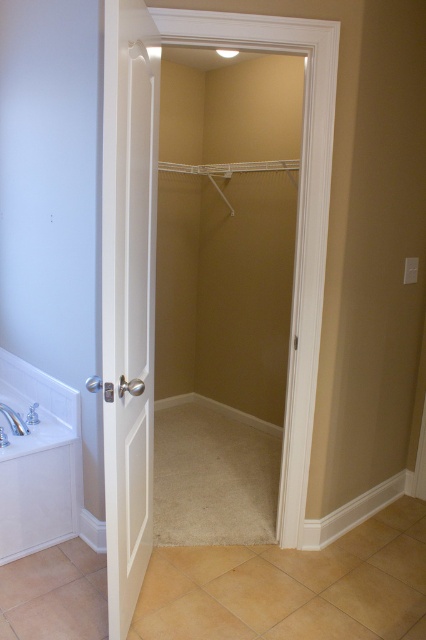
Question: Observing the image, what is the correct spatial positioning of white glossy bathtub at lower left in reference to white porcelain sink at lower left?

Choices:
 (A) above
 (B) below

Answer: (A)

Question: Which object is farther from the camera taking this photo?

Choices:
 (A) white porcelain sink at lower left
 (B) white glossy bathtub at lower left

Answer: (B)

Question: Is white glossy bathtub at lower left to the left of white porcelain sink at lower left from the viewer's perspective?

Choices:
 (A) yes
 (B) no

Answer: (B)

Question: Among these points, which one is farthest from the camera?

Choices:
 (A) (2, 451)
 (B) (14, 380)

Answer: (B)

Question: Which of the following is the farthest from the observer?

Choices:
 (A) (0, 413)
 (B) (36, 397)

Answer: (B)

Question: Is white glossy bathtub at lower left behind white porcelain sink at lower left?

Choices:
 (A) no
 (B) yes

Answer: (B)